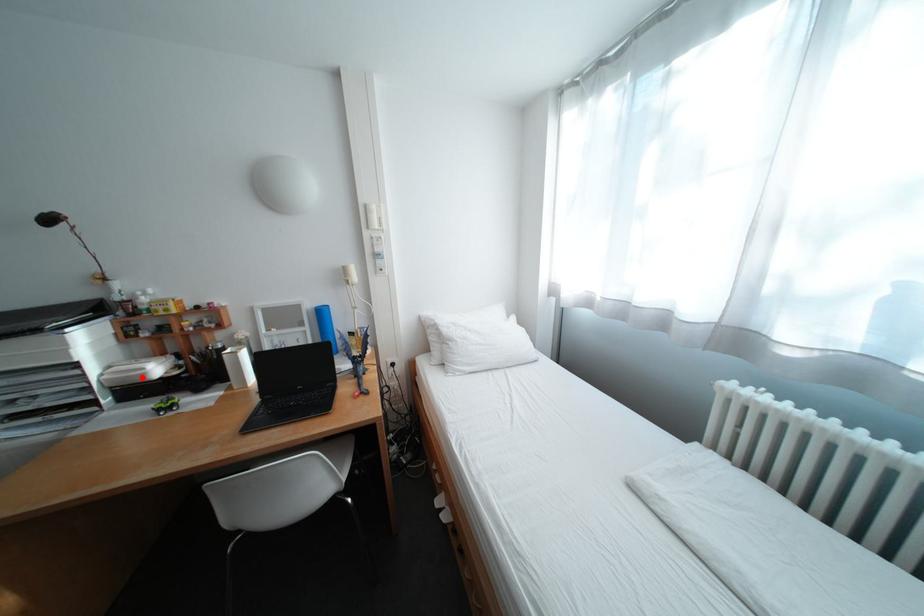
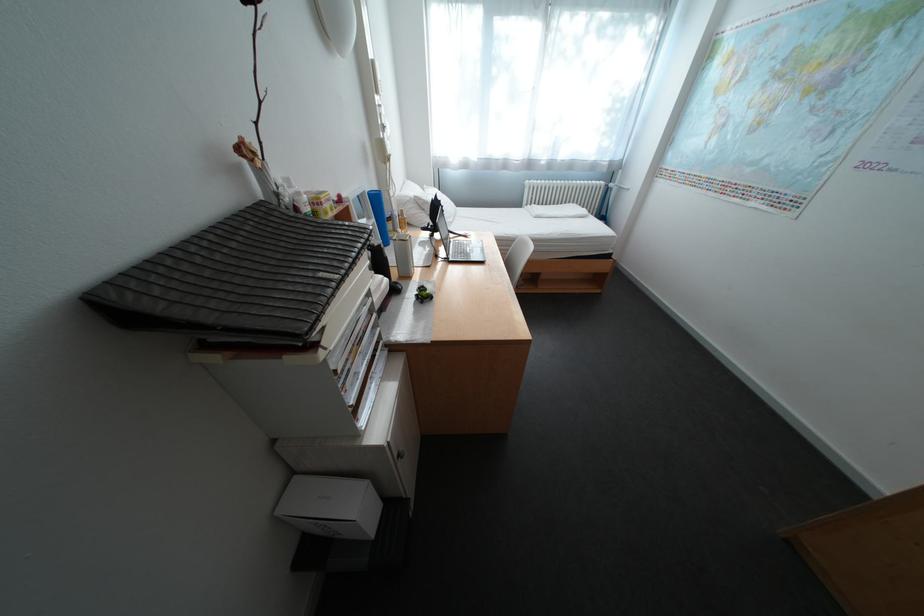
The point at the highlighted location is marked in the first image. Where is the corresponding point in the second image?

(395, 292)